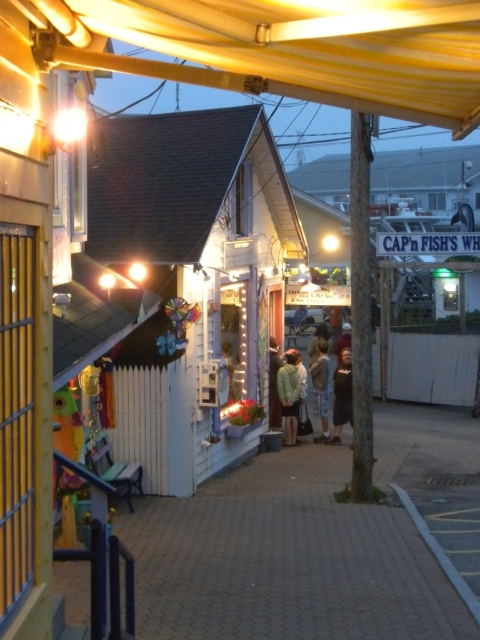
In the scene shown: You are a tourist standing on the walkway in the coastal town. You see the white wooden hut at center and the light brown fabric shirt at center. Which object is positioned higher relative to the other?

The white wooden hut at center is above the light brown fabric shirt at center, so it is positioned higher.

In the scene shown: You are a delivery person carrying a package that requires a 12 feet wide space to place. You see the white wooden hut at center and the light brown fabric shirt at center. Can you place the package between them?

The white wooden hut at center and the light brown fabric shirt at center are 10.65 feet apart from each other. Since the required space is 12 feet, the package cannot be placed between them as the distance is insufficient.